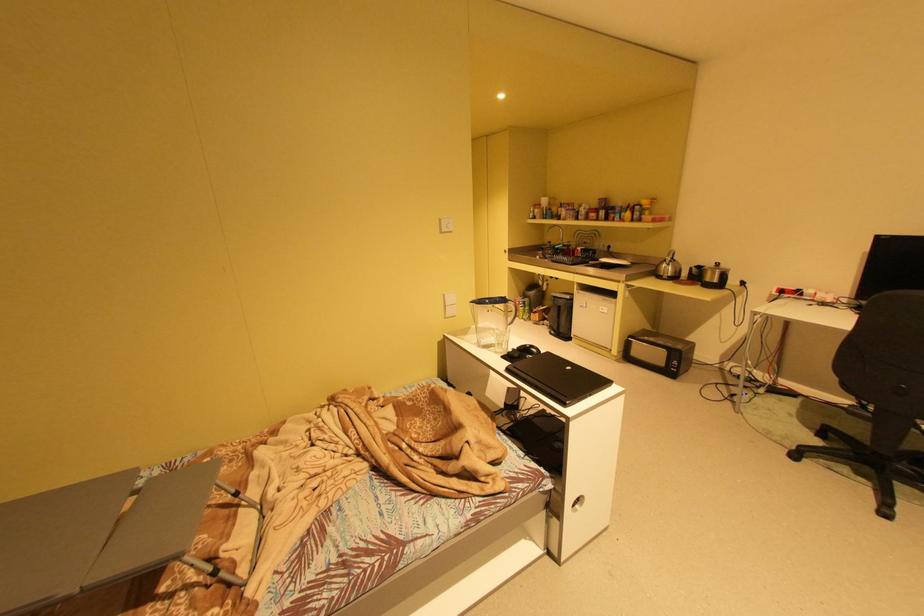
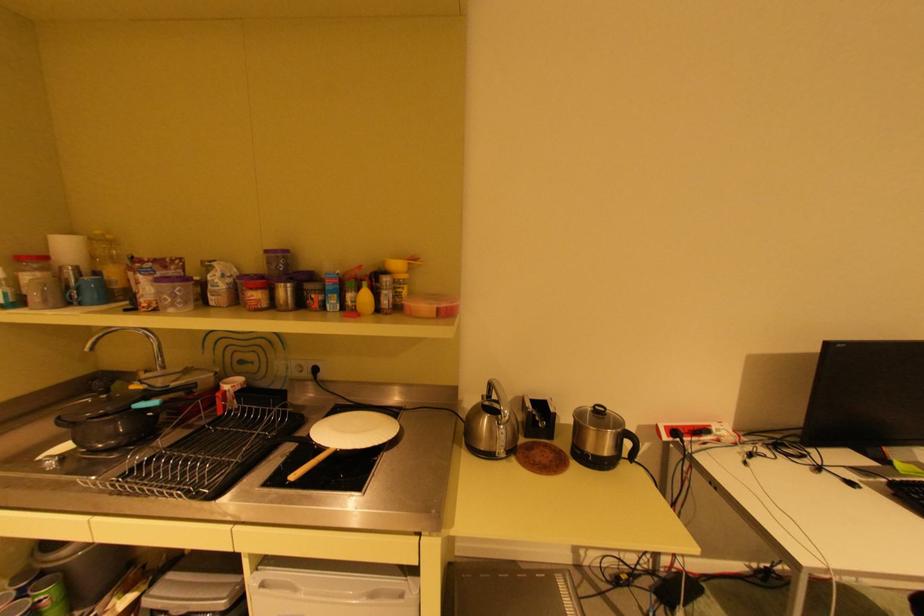
Where in the second image is the point corresponding to the point at 601,215 from the first image?

(264, 294)